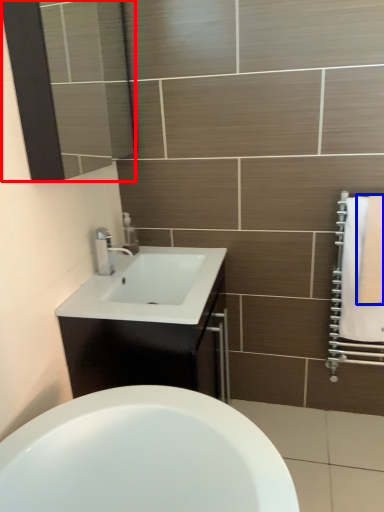
Question: Which object appears farthest to the camera in this image, mirror (highlighted by a red box) or bath towel (highlighted by a blue box)?

Choices:
 (A) mirror
 (B) bath towel

Answer: (B)